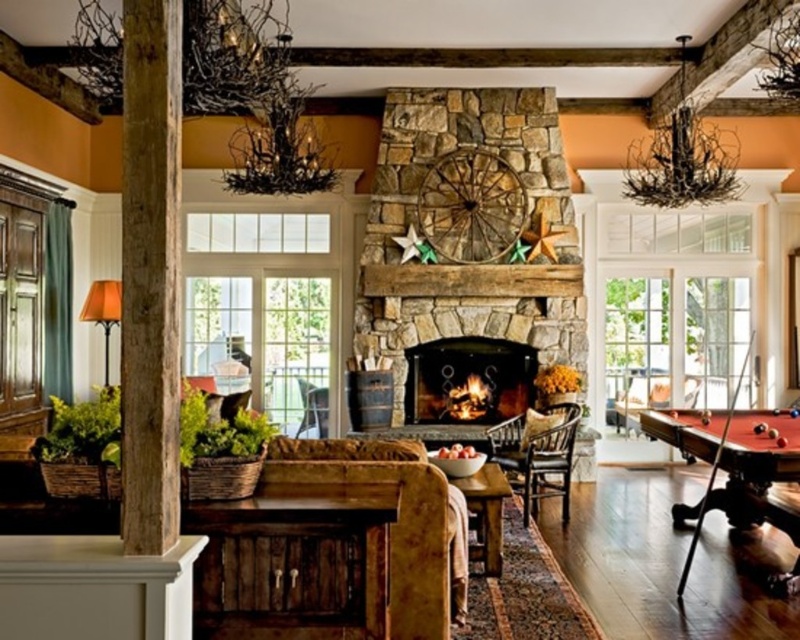
Question: Can you confirm if brown rough wood pillar at left is bigger than dark brown wood armchair at center?

Choices:
 (A) yes
 (B) no

Answer: (B)

Question: Is rubberized brown pool table at lower right wider than rustic stone fireplace at center?

Choices:
 (A) yes
 (B) no

Answer: (A)

Question: Among these points, which one is farthest from the camera?

Choices:
 (A) (649, 426)
 (B) (480, 349)
 (C) (152, 220)

Answer: (B)

Question: Among these points, which one is farthest from the camera?

Choices:
 (A) (316, 429)
 (B) (516, 440)
 (C) (725, 490)
 (D) (488, 346)

Answer: (A)

Question: Which point is closer to the camera?

Choices:
 (A) brown leather armchair at center
 (B) rustic stone fireplace at center

Answer: (B)

Question: Observing the image, what is the correct spatial positioning of brown rough wood pillar at left in reference to dark brown wood armchair at center?

Choices:
 (A) above
 (B) below

Answer: (A)